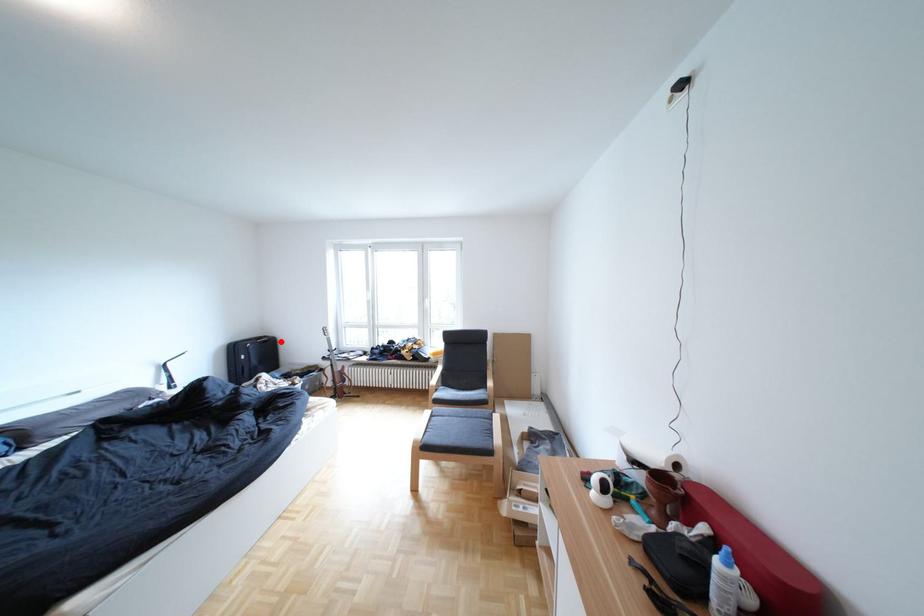
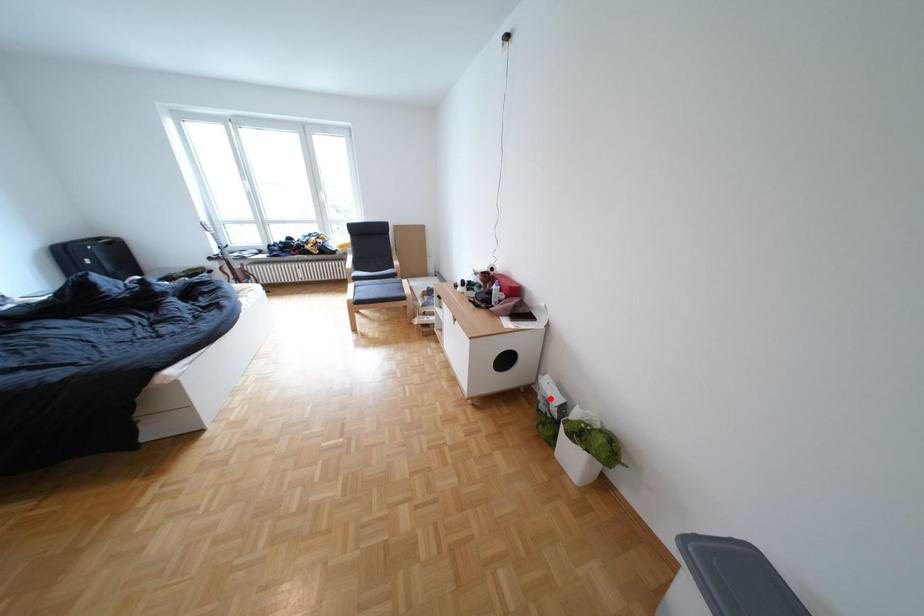
I am providing you with two images of the same scene from different viewpoints. A red point is marked on the first image and another point is marked on the second image. Do the highlighted points in image1 and image2 indicate the same real-world spot?

No